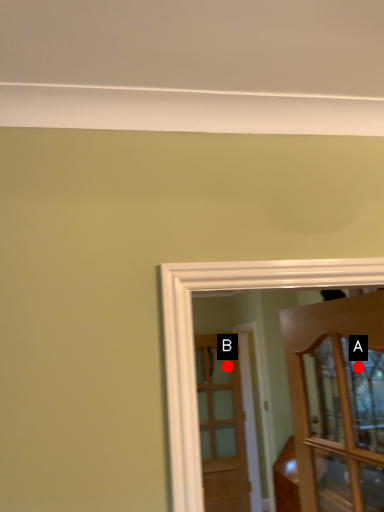
Question: Two points are circled on the image, labeled by A and B beside each circle. Which point is closer to the camera?

Choices:
 (A) A is closer
 (B) B is closer

Answer: (A)